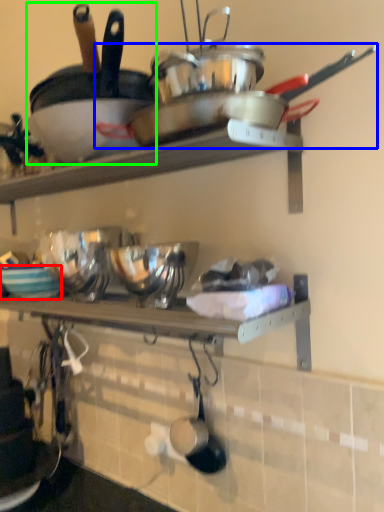
Question: Which object is positioned farthest from bowl (highlighted by a red box)? Select from wok (highlighted by a blue box) and frying pan (highlighted by a green box).

Choices:
 (A) wok
 (B) frying pan

Answer: (A)